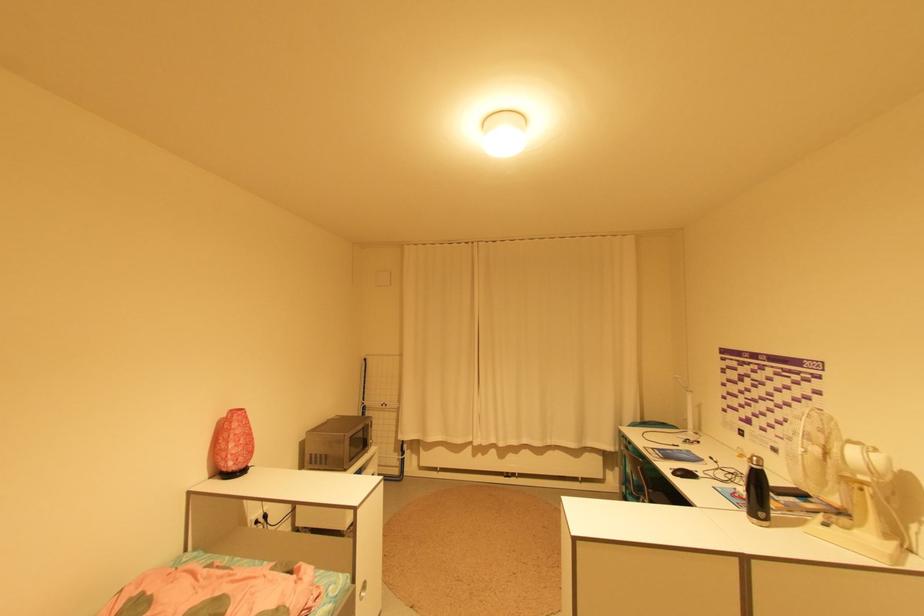
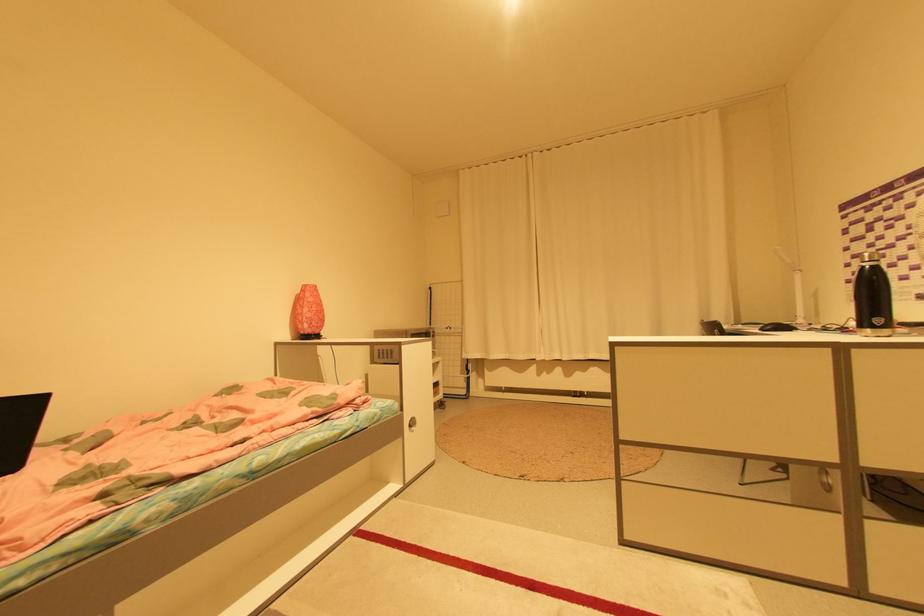
Where in the second image is the point corresponding to [237,411] from the first image?

(311, 285)